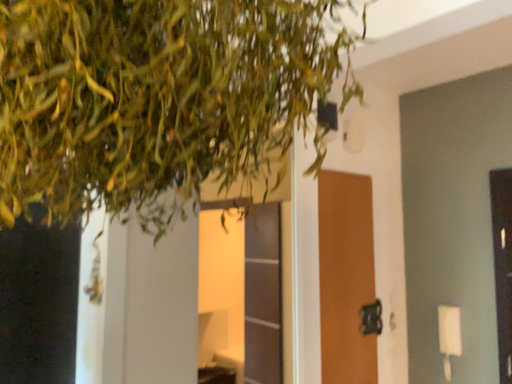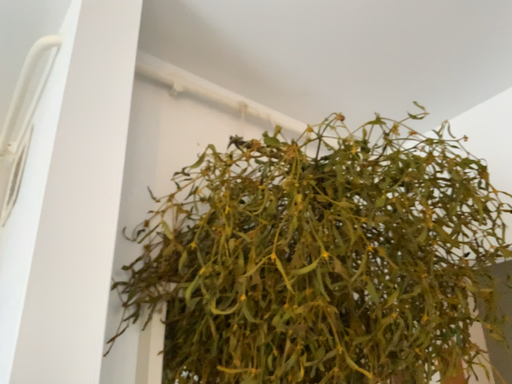
Question: How did the camera likely rotate when shooting the video?

Choices:
 (A) rotated upward
 (B) rotated downward

Answer: (A)